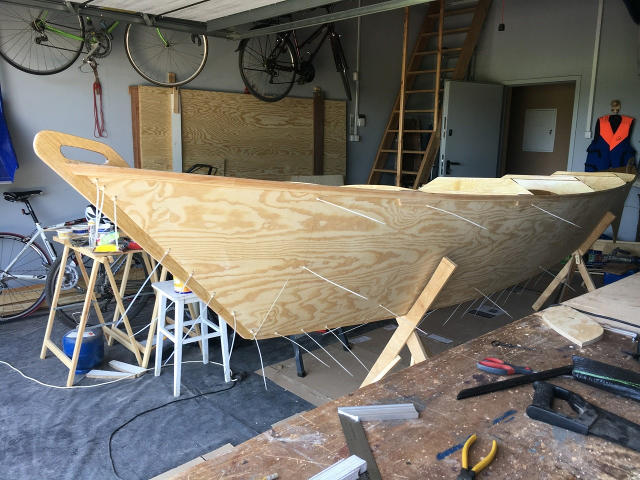
Identify the location of work table. The image size is (640, 480). (444, 394).